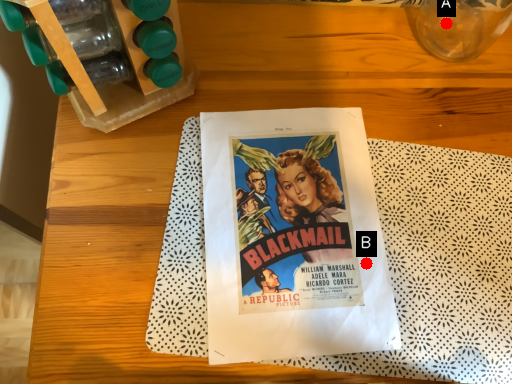
Question: Two points are circled on the image, labeled by A and B beside each circle. Which point is closer to the camera taking this photo?

Choices:
 (A) A is closer
 (B) B is closer

Answer: (B)